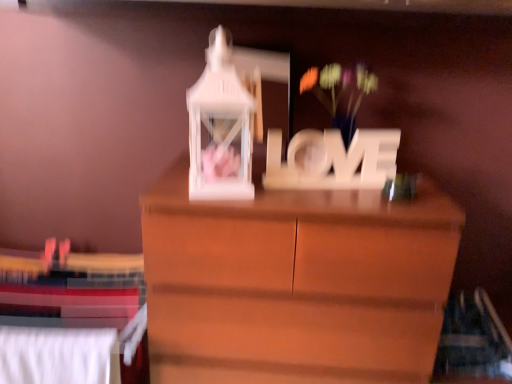
Question: Is white fabric bed at lower left looking in the opposite direction of white matte floral arrangement at center?

Choices:
 (A) yes
 (B) no

Answer: (B)

Question: Is white fabric bed at lower left smaller than white matte floral arrangement at center?

Choices:
 (A) yes
 (B) no

Answer: (A)

Question: Is white fabric bed at lower left bigger than white matte floral arrangement at center?

Choices:
 (A) no
 (B) yes

Answer: (A)

Question: Does white fabric bed at lower left have a greater height compared to white matte floral arrangement at center?

Choices:
 (A) no
 (B) yes

Answer: (B)

Question: Considering the relative sizes of white fabric bed at lower left and white matte floral arrangement at center in the image provided, is white fabric bed at lower left shorter than white matte floral arrangement at center?

Choices:
 (A) no
 (B) yes

Answer: (A)

Question: Considering the relative positions of white fabric bed at lower left and white matte floral arrangement at center in the image provided, is white fabric bed at lower left to the right of white matte floral arrangement at center from the viewer's perspective?

Choices:
 (A) no
 (B) yes

Answer: (A)

Question: From a real-world perspective, is white matte floral arrangement at center physically below wooden "love" sign at center?

Choices:
 (A) no
 (B) yes

Answer: (A)

Question: Considering the relative sizes of white matte floral arrangement at center and wooden "love" sign at center in the image provided, is white matte floral arrangement at center shorter than wooden "love" sign at center?

Choices:
 (A) no
 (B) yes

Answer: (A)

Question: Can you confirm if white matte floral arrangement at center is taller than wooden "love" sign at center?

Choices:
 (A) no
 (B) yes

Answer: (B)

Question: Considering the relative positions of white matte floral arrangement at center and wooden "love" sign at center in the image provided, is white matte floral arrangement at center to the left of wooden "love" sign at center from the viewer's perspective?

Choices:
 (A) no
 (B) yes

Answer: (A)

Question: Are white matte floral arrangement at center and wooden "love" sign at center making contact?

Choices:
 (A) no
 (B) yes

Answer: (A)

Question: Are white matte floral arrangement at center and wooden "love" sign at center far apart?

Choices:
 (A) yes
 (B) no

Answer: (B)

Question: Is white matte floral arrangement at center positioned behind white fabric bed at lower left?

Choices:
 (A) no
 (B) yes

Answer: (A)